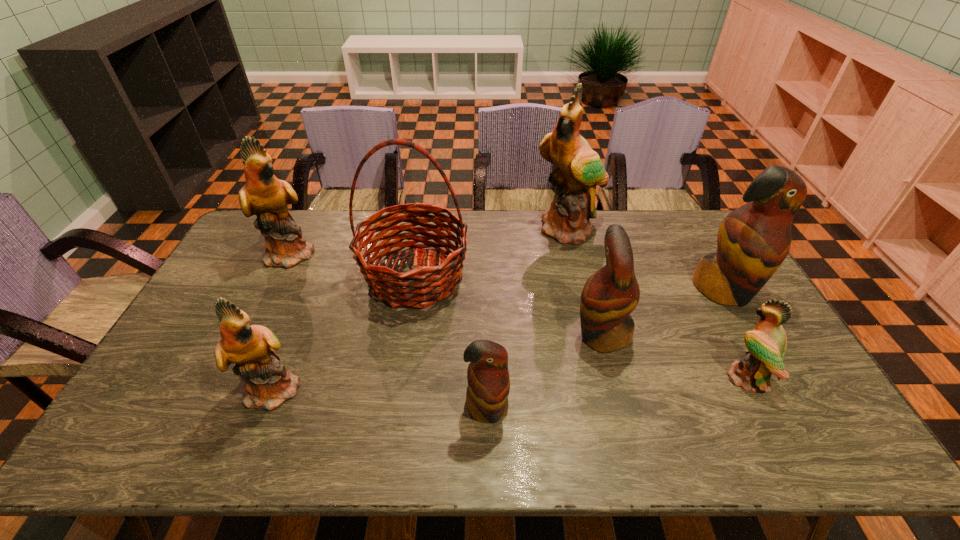
The height and width of the screenshot is (540, 960). I want to click on the leftmost red parrot, so pyautogui.click(x=488, y=388).

You are a GUI agent. You are given a task and a screenshot of the screen. Output one action in this format:
    pyautogui.click(x=<x>, y=<y>)
    Task: Click on the third parrot from left to right
    
    Given the screenshot: What is the action you would take?
    pyautogui.click(x=488, y=388)

I want to click on vacant space located 0.100m on the front-facing side of the biggest green parrot, so click(x=577, y=267).

Where is `blank area located on the handle side of the basket`? This screenshot has height=540, width=960. blank area located on the handle side of the basket is located at coordinates (392, 428).

You are a GUI agent. You are given a task and a screenshot of the screen. Output one action in this format:
    pyautogui.click(x=<x>, y=<y>)
    Task: Click on the vacant space located on the front-facing side of the second biggest green parrot
    
    Given the screenshot: What is the action you would take?
    pyautogui.click(x=332, y=253)

Locate an element on the screen. free space located 0.300m on the face of the biggest red parrot is located at coordinates (788, 403).

Find the location of a particular element. This screenshot has width=960, height=540. free space located on the face of the second red parrot from right to left is located at coordinates (482, 334).

Locate an element on the screen. free space located 0.230m on the face of the second red parrot from right to left is located at coordinates (492, 334).

In order to click on vacant space located 0.300m on the face of the second red parrot from right to left in this screenshot , I will do `click(468, 334)`.

You are a GUI agent. You are given a task and a screenshot of the screen. Output one action in this format:
    pyautogui.click(x=<x>, y=<y>)
    Task: Click on the free space located on the front-facing side of the second smallest green parrot
    The height and width of the screenshot is (540, 960).
    Given the screenshot: What is the action you would take?
    pyautogui.click(x=377, y=388)